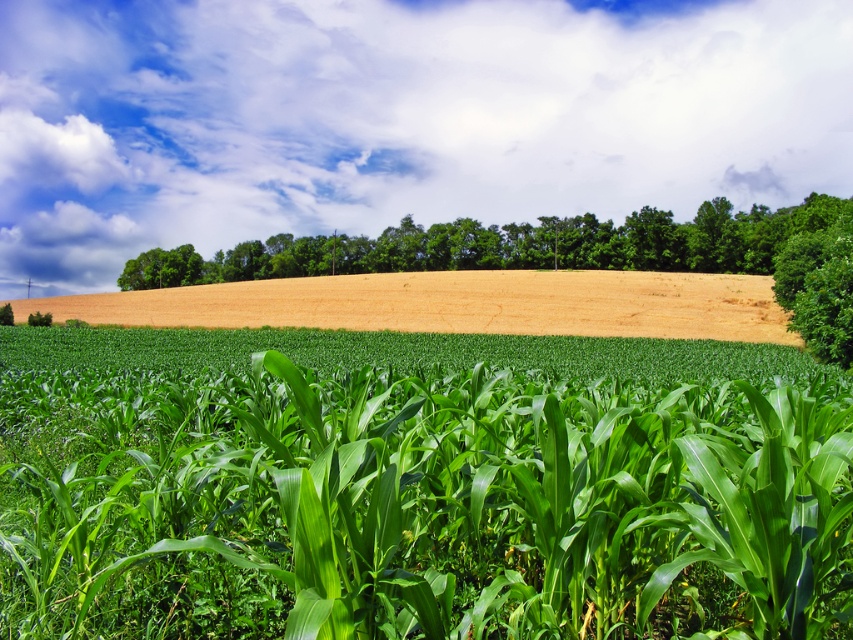
You are a farmer checking the crops from a drone. You notice both the green leafy corn at center and the golden dry wheat field at center. Which crop is located below the other?

The green leafy corn at center is positioned under the golden dry wheat field at center, so the corn is below the wheat field.

You are a farmer looking at the image. You need to determine which of the two objects, the green leafy corn at center or the green leafy trees at upper center, is smaller in size. Based on the scene, which one is smaller?

The green leafy corn at center is smaller in size compared to the green leafy trees at upper center.

From the picture: You are a farmer checking the growth of your crops. You notice the green leafy corn at center and the golden dry wheat field at center. Which crop area is larger in size?

The golden dry wheat field at center is larger than the green leafy corn at center.